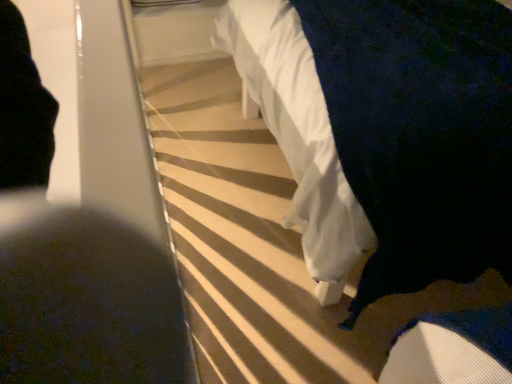
You are a GUI agent. You are given a task and a screenshot of the screen. Output one action in this format:
    pyautogui.click(x=<x>, y=<y>)
    Task: Click on the dark fabric at lower left
    This screenshot has height=384, width=512.
    Given the screenshot: What is the action you would take?
    pyautogui.click(x=73, y=262)

The image size is (512, 384). What do you see at coordinates (73, 262) in the screenshot?
I see `dark fabric at lower left` at bounding box center [73, 262].

Image resolution: width=512 pixels, height=384 pixels. What do you see at coordinates (387, 131) in the screenshot?
I see `white fabric bed at upper center` at bounding box center [387, 131].

Image resolution: width=512 pixels, height=384 pixels. Identify the location of white fabric bed at upper center. (387, 131).

The width and height of the screenshot is (512, 384). What are the coordinates of `dark fabric at lower left` in the screenshot? It's located at (73, 262).

Based on their positions, is white fabric bed at upper center located to the left or right of dark fabric at lower left?

white fabric bed at upper center is positioned on dark fabric at lower left's right side.

Considering the relative positions of white fabric bed at upper center and dark fabric at lower left in the image provided, is white fabric bed at upper center in front of dark fabric at lower left?

No, it is behind dark fabric at lower left.

Does point (328, 129) lie in front of point (164, 312)?

Yes, it is in front of point (164, 312).

From the image's perspective, between white fabric bed at upper center and dark fabric at lower left, which one is located above?

dark fabric at lower left.

From a real-world perspective, does white fabric bed at upper center stand above dark fabric at lower left?

Incorrect, from a real-world perspective, white fabric bed at upper center is lower than dark fabric at lower left.

Can you confirm if white fabric bed at upper center is wider than dark fabric at lower left?

Indeed, white fabric bed at upper center has a greater width compared to dark fabric at lower left.

Considering the relative sizes of white fabric bed at upper center and dark fabric at lower left in the image provided, is white fabric bed at upper center taller than dark fabric at lower left?

No, white fabric bed at upper center is not taller than dark fabric at lower left.

Is white fabric bed at upper center bigger than dark fabric at lower left?

No.

Is white fabric bed at upper center not inside dark fabric at lower left?

Yes, white fabric bed at upper center is located beyond the bounds of dark fabric at lower left.

Does white fabric bed at upper center touch dark fabric at lower left?

No, white fabric bed at upper center is not with dark fabric at lower left.

Is white fabric bed at upper center looking in the opposite direction of dark fabric at lower left?

No, white fabric bed at upper center is not facing the opposite direction of dark fabric at lower left.

In the scene shown: How much distance is there between white fabric bed at upper center and dark fabric at lower left?

white fabric bed at upper center and dark fabric at lower left are 3.91 feet apart from each other.

Locate an element on the screen. The image size is (512, 384). furniture that appears on the right of dark fabric at lower left is located at coordinates (387, 131).

Is dark fabric at lower left at the right side of white fabric bed at upper center?

No, dark fabric at lower left is not to the right of white fabric bed at upper center.

Considering the positions of objects dark fabric at lower left and white fabric bed at upper center in the image provided, who is in front, dark fabric at lower left or white fabric bed at upper center?

dark fabric at lower left is more forward.

Which is closer, (95,347) or (455,55)?

Point (95,347) is positioned farther from the camera compared to point (455,55).

From the image's perspective, would you say dark fabric at lower left is shown under white fabric bed at upper center?

No.

From a real-world perspective, is dark fabric at lower left under white fabric bed at upper center?

Actually, dark fabric at lower left is physically above white fabric bed at upper center in the real world.

In the scene shown: Which object is wider, dark fabric at lower left or white fabric bed at upper center?

white fabric bed at upper center.

From their relative heights in the image, would you say dark fabric at lower left is taller or shorter than white fabric bed at upper center?

Considering their sizes, dark fabric at lower left has more height than white fabric bed at upper center.

Considering the relative sizes of dark fabric at lower left and white fabric bed at upper center in the image provided, is dark fabric at lower left bigger than white fabric bed at upper center?

Yes.

Is dark fabric at lower left surrounding white fabric bed at upper center?

No.

Looking at this image, can you see dark fabric at lower left touching white fabric bed at upper center?

No, dark fabric at lower left is not beside white fabric bed at upper center.

Does dark fabric at lower left turn towards white fabric bed at upper center?

No, dark fabric at lower left is not turned towards white fabric bed at upper center.

In order to click on person above the white fabric bed at upper center (from the image's perspective) in this screenshot , I will do `click(73, 262)`.

Identify the location of person on the left of white fabric bed at upper center. (73, 262).

Where is `person in front of the white fabric bed at upper center`? person in front of the white fabric bed at upper center is located at coordinates (73, 262).